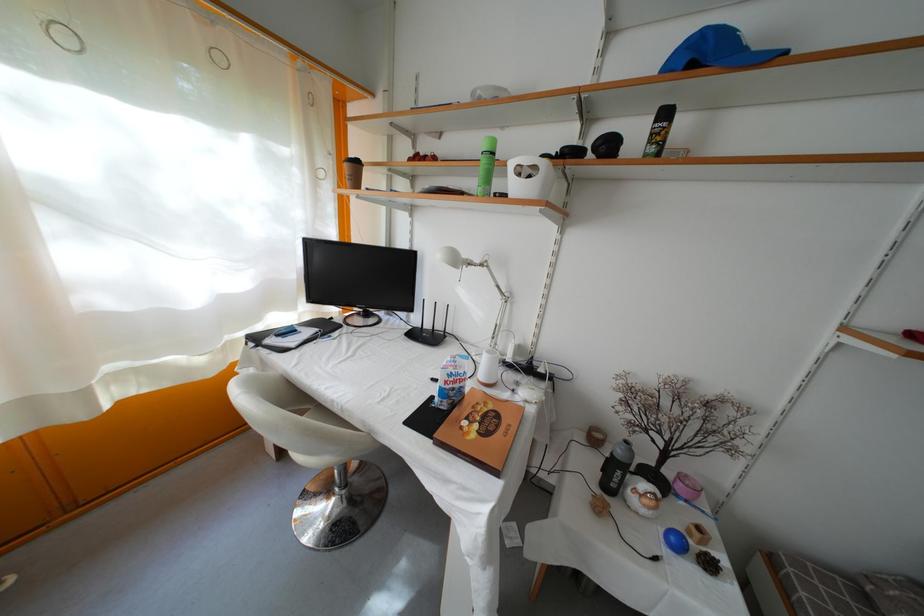
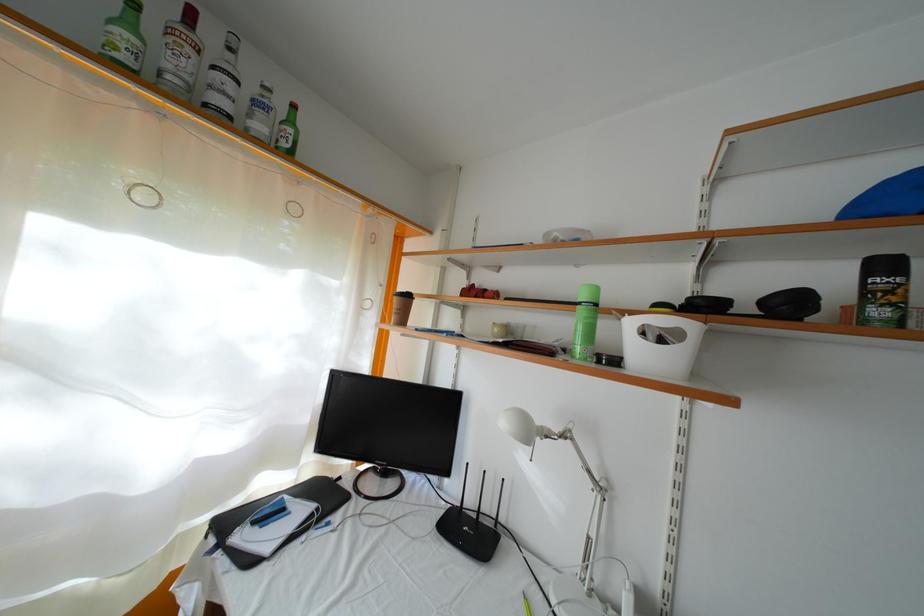
Where in the second image is the point corresponding to point 536,184 from the first image?

(667, 346)